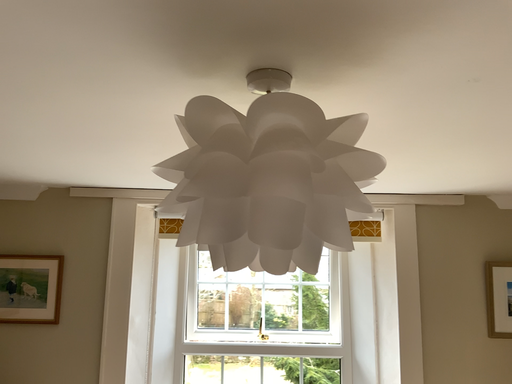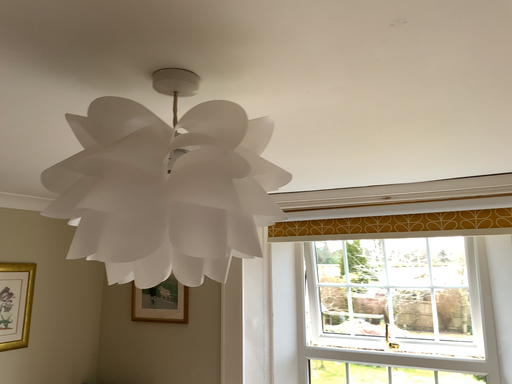
Question: Which way did the camera rotate in the video?

Choices:
 (A) rotated left
 (B) rotated right

Answer: (A)